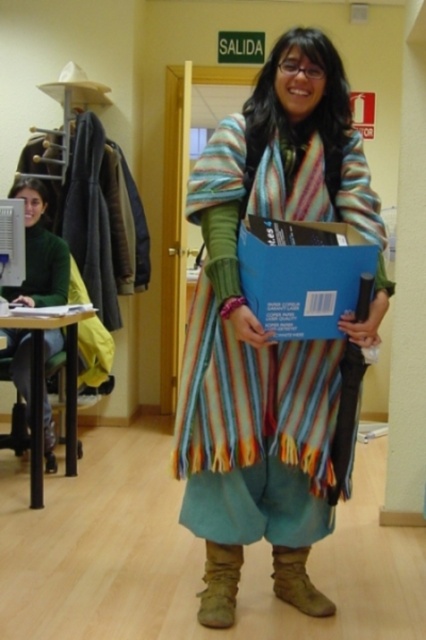
You are organizing a clothing donation drive and need to determine the order of items based on their positions in the image. Which clothing item is closer to you, the observer, between the striped woolen poncho at center and the green matte sweater at left?

The striped woolen poncho at center is closer to you because it is positioned in front of the green matte sweater at left.

You are organizing a clothing store display and need to arrange the striped woolen poncho at center and the green matte sweater at left according to their positions in the image. Which item should be placed to the right of the other?

The striped woolen poncho at center is positioned on the right side of green matte sweater at left, so the striped woolen poncho at center should be placed to the right of the green matte sweater at left.